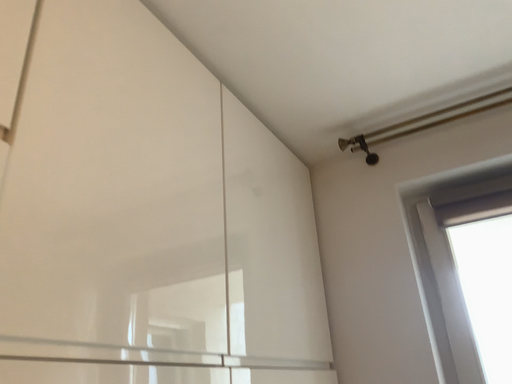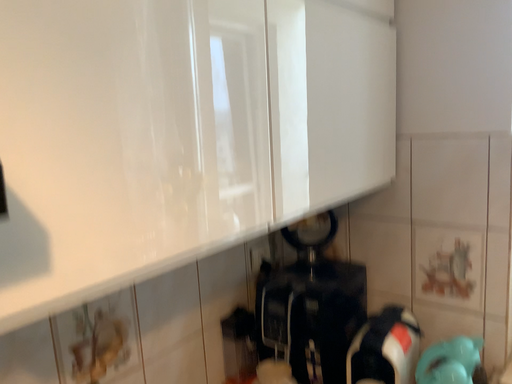
Question: Which way did the camera rotate in the video?

Choices:
 (A) rotated right
 (B) rotated left

Answer: (B)